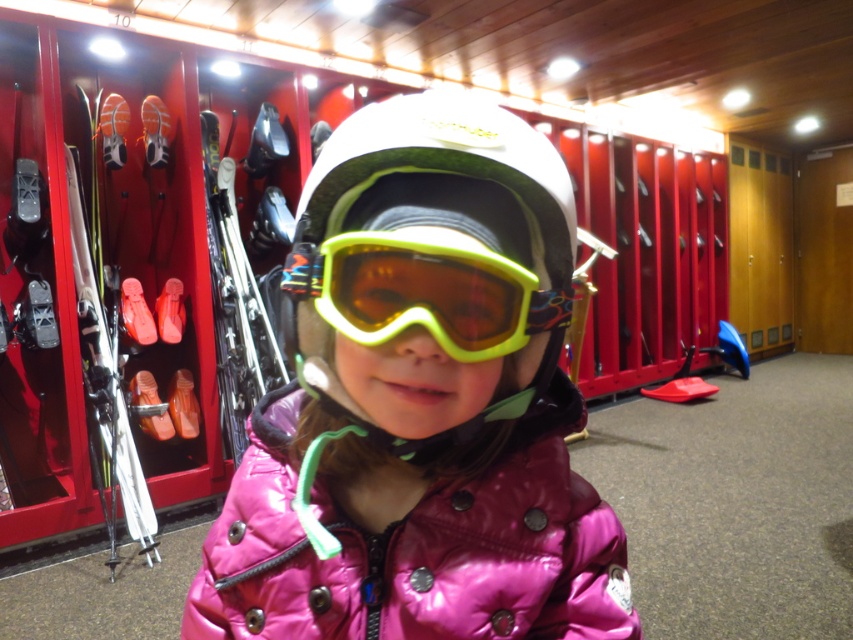
Question: Is pink glossy jacket at center smaller than yellow matte/glossy goggles at center?

Choices:
 (A) yes
 (B) no

Answer: (B)

Question: Among these points, which one is farthest from the camera?

Choices:
 (A) (405, 579)
 (B) (438, 337)
 (C) (323, 371)

Answer: (A)

Question: Is pink shiny jacket at center above yellow matte/glossy goggles at center?

Choices:
 (A) no
 (B) yes

Answer: (A)

Question: Does pink glossy jacket at center have a greater width compared to white matte helmet at center?

Choices:
 (A) no
 (B) yes

Answer: (B)

Question: Among these points, which one is nearest to the camera?

Choices:
 (A) (287, 445)
 (B) (83, 348)

Answer: (A)

Question: Which is farther from the yellow matte/glossy goggles at center?

Choices:
 (A) pink shiny jacket at center
 (B) shiny metallic skis at left

Answer: (B)